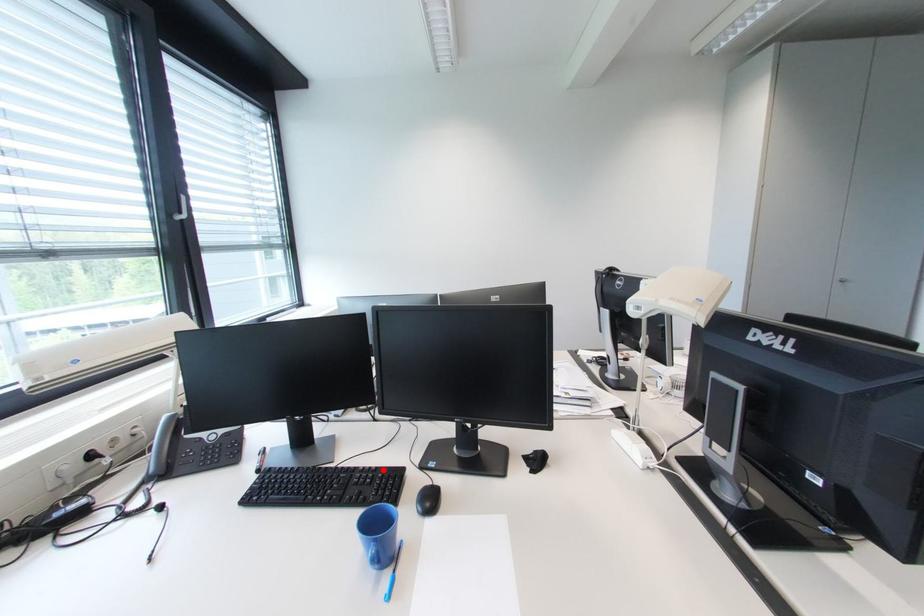
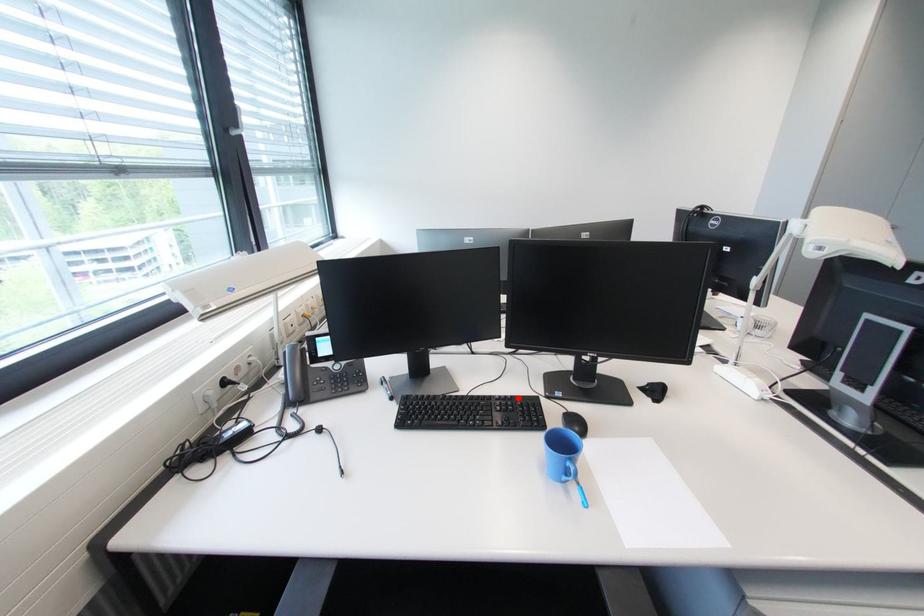
I am providing you with two images of the same scene from different viewpoints. A red point is marked on the first image and another point is marked on the second image. Does the point marked in image1 correspond to the same location as the one in image2?

Yes